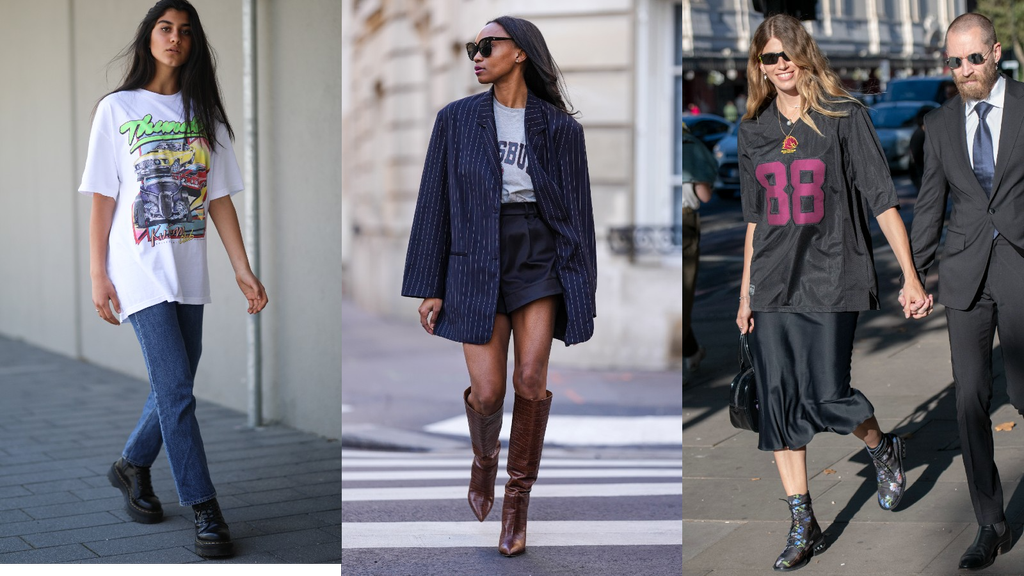
Locate an element on the screen. The image size is (1024, 576). white paint stripe is located at coordinates (423, 535), (402, 492), (398, 473), (407, 462).